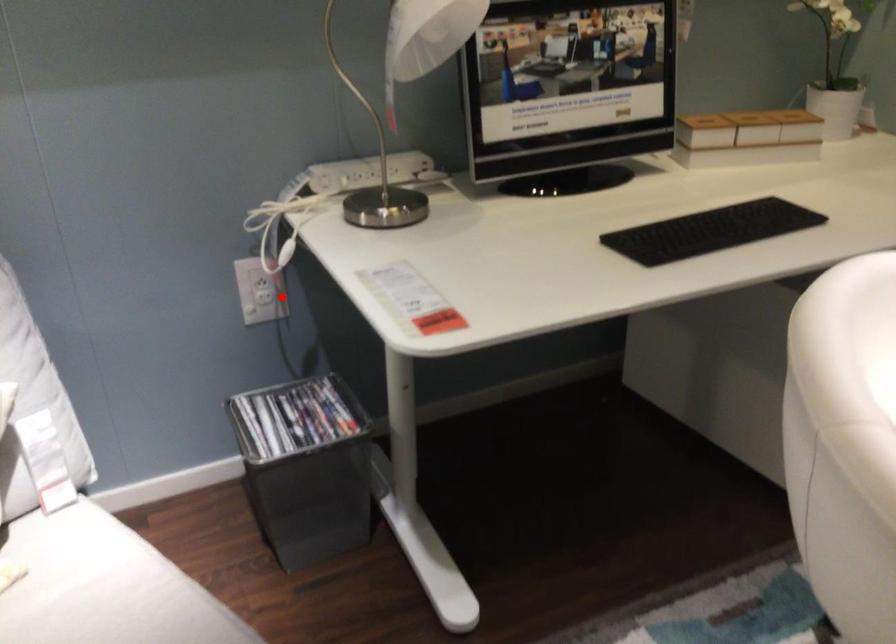
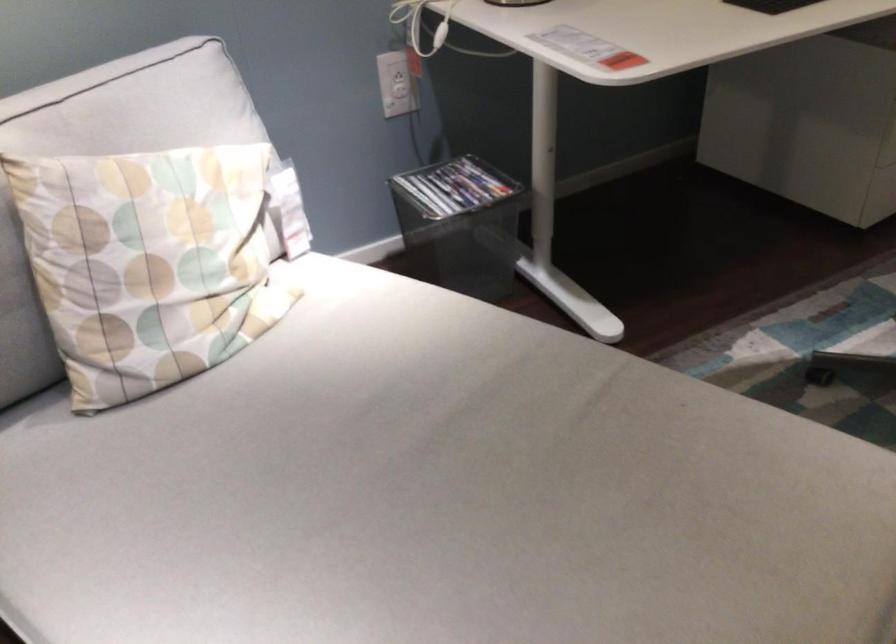
Question: A red point is marked in image1. In image2, is the corresponding 3D point closer to the camera or farther? Reply with the corresponding letter.

Choices:
 (A) The corresponding 3D point is closer.
 (B) The corresponding 3D point is farther.

Answer: (B)